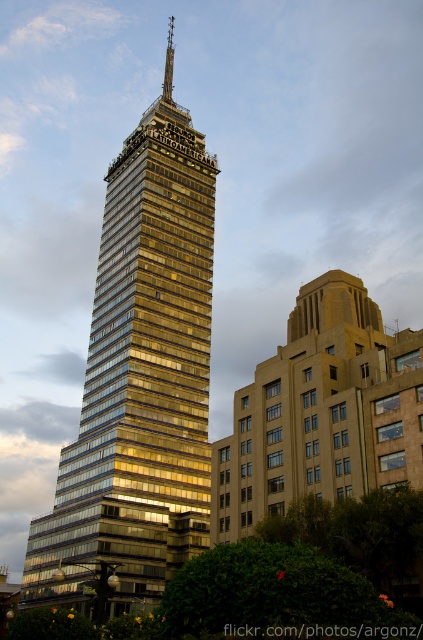
You are standing at the point marked by the coordinates point (139,387) in the image. Looking around, you see the gold glassy building at center. Which direction should you face to look towards the gold glassy building at center?

You are already facing the gold glassy building at center because the point (139,387) indicates its location. So, you should face the direction where the gold glassy building at center is located.

You are standing at the entrance of the Torre Latinoamericana on the left. You want to walk directly towards the gold glassy building at center. In which general direction should you head?

The gold glassy building at center is located at point (139, 387), so you should head towards the center of the image to reach it.

Based on the photo, you are an architect evaluating the urban skyline. You notice the gold glassy building at center and the shiny metallic spire at center. Which structure has a greater height?

The gold glassy building at center is taller than the shiny metallic spire at center, so the gold glassy building at center has a greater height.